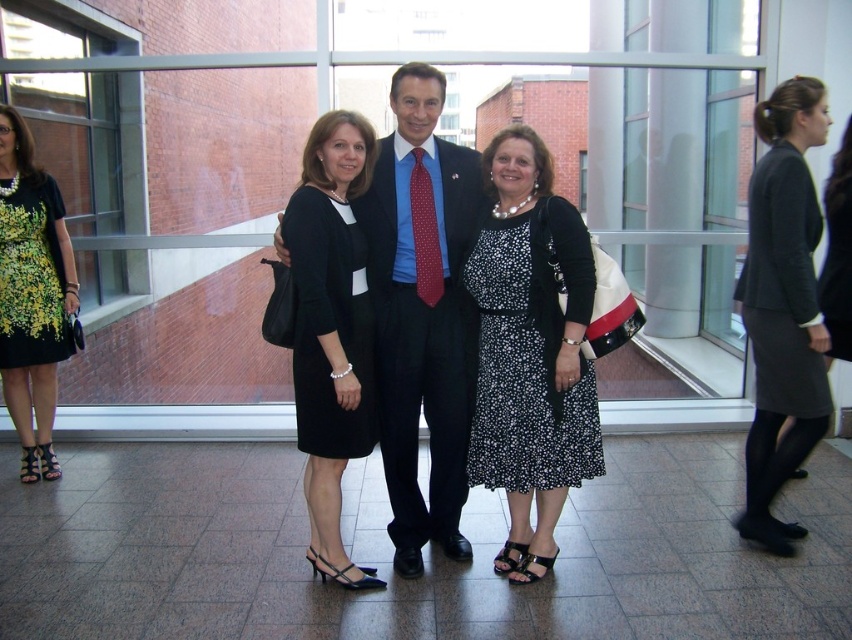
Is floral dress at left closer to camera compared to printed fabric dress at left?

No, floral dress at left is behind printed fabric dress at left.

Does floral dress at left have a smaller size compared to printed fabric dress at left?

No.

Find the location of a particular element. floral dress at left is located at coordinates (32, 294).

This screenshot has height=640, width=852. Identify the location of floral dress at left. (32, 294).

This screenshot has width=852, height=640. Describe the element at coordinates (423, 336) in the screenshot. I see `dark blue suit at center` at that location.

Can you confirm if dark blue suit at center is positioned to the right of dark gray wool skirt at right?

Incorrect, dark blue suit at center is not on the right side of dark gray wool skirt at right.

Between point (412, 316) and point (787, 241), which one is positioned behind?

The point (412, 316) is behind.

I want to click on dark blue suit at center, so click(x=423, y=336).

This screenshot has width=852, height=640. Find the location of `dark blue suit at center`. dark blue suit at center is located at coordinates (423, 336).

Who is more distant from viewer, (453, 288) or (45, 339)?

The point (45, 339) is more distant.

Where is `dark blue suit at center`? The height and width of the screenshot is (640, 852). dark blue suit at center is located at coordinates (423, 336).